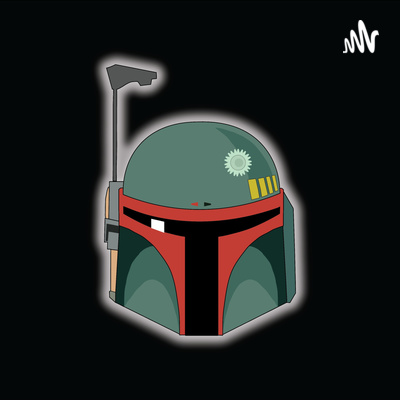
Locate an element on the screen. silver metallic rod is located at coordinates (114, 124).